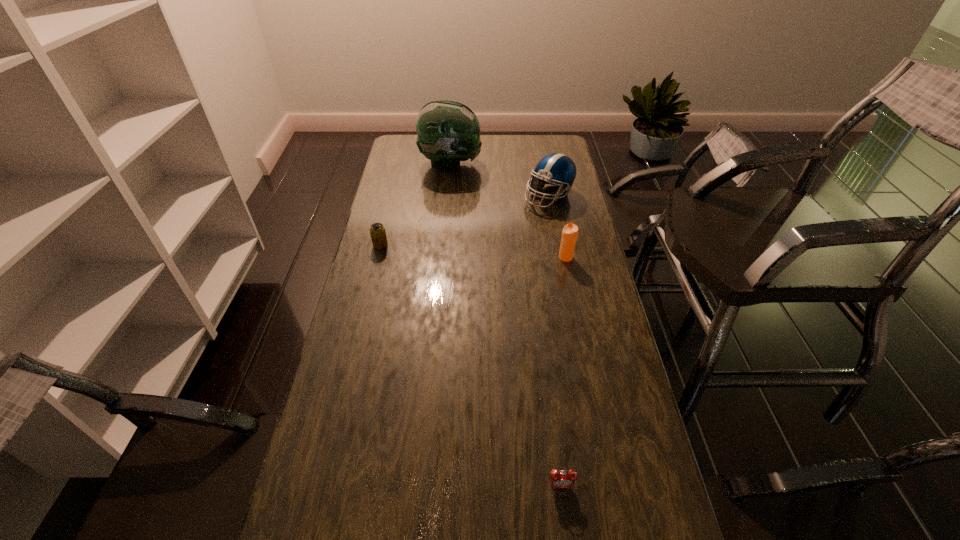
I want to click on free region at the left edge of the desktop, so click(392, 172).

Find the location of a particular element. The height and width of the screenshot is (540, 960). vacant space at the right edge of the desktop is located at coordinates (571, 202).

In the image, there is a desktop. Where is `vacant space at the far right corner`? This screenshot has height=540, width=960. vacant space at the far right corner is located at coordinates (542, 144).

Locate an element on the screen. The height and width of the screenshot is (540, 960). free space between the second nearest object and the alarm clock is located at coordinates (564, 372).

You are a GUI agent. You are given a task and a screenshot of the screen. Output one action in this format:
    pyautogui.click(x=<x>, y=<y>)
    Task: Click on the vacant space in between the alarm clock and the taller football helmet
    The image size is (960, 540).
    Given the screenshot: What is the action you would take?
    pyautogui.click(x=506, y=325)

Where is `unoccupied position between the candle and the fourth nearest object`? The image size is (960, 540). unoccupied position between the candle and the fourth nearest object is located at coordinates [x=558, y=227].

At what (x,y) coordinates should I click in order to perform the action: click on vacant space that's between the farther football helmet and the nearer football helmet. Please return your answer as a coordinate pair (x, y). This screenshot has width=960, height=540. Looking at the image, I should click on (500, 180).

At what (x,y) coordinates should I click in order to perform the action: click on free space that is in between the nearest object and the fourth farthest object. Please return your answer as a coordinate pair (x, y). This screenshot has height=540, width=960. Looking at the image, I should click on (564, 372).

Where is `blank region between the alarm clock and the beer can`? blank region between the alarm clock and the beer can is located at coordinates (470, 365).

Identify the location of free space between the farther football helmet and the leftmost object. The height and width of the screenshot is (540, 960). (416, 204).